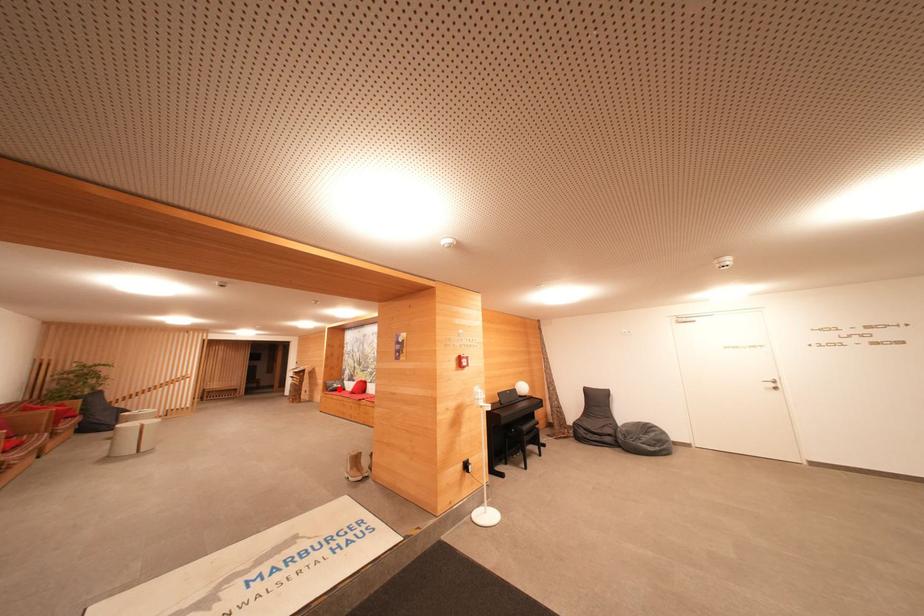
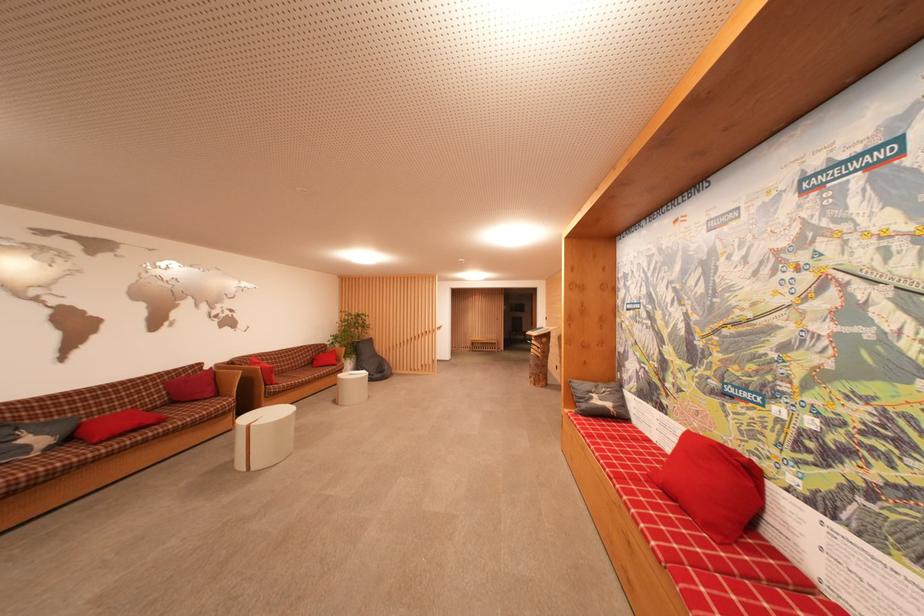
Question: I am providing you with two images of the same scene from different viewpoints. Image1 has a red point marked. In image2, the corresponding 3D location appears at what relative position? Reply with the corresponding letter.

Choices:
 (A) Closer
 (B) Farther

Answer: (A)